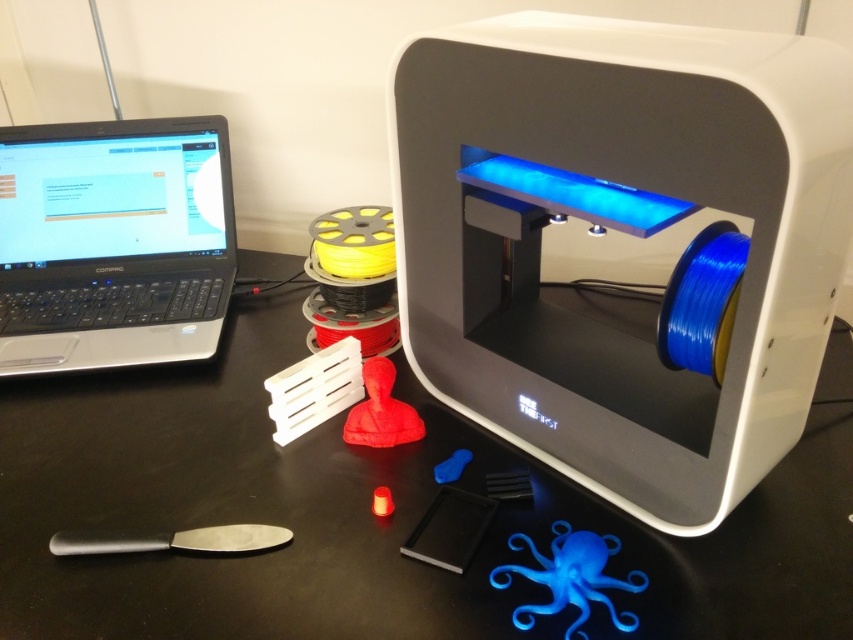
You are standing in front of the workspace setup. There are two points marked in the scene, one at coordinates point (651, 42) and the other at point (276, 275). Which point is closer to you?

Point (651, 42) is closer to the camera than point (276, 275), so the point at coordinates point (651, 42) is closer to you.

From the picture: You are an artist working in this workspace and need to access the matte red bust at center. Can you reach it without moving the black matte spatula at lower left?

The black matte spatula at lower left is in front of the matte red bust at center, so you can reach the matte red bust at center by moving around the spatula or lifting it, but since the question specifies not moving the spatula, you might not be able to access the bust directly without moving the spatula.

You are setting up a new 3D printer in your home office. You have a white plastic 3d printer at center and a black matte table at center. Which object is taller?

The white plastic 3d printer at center is much taller than the black matte table at center according to the description.